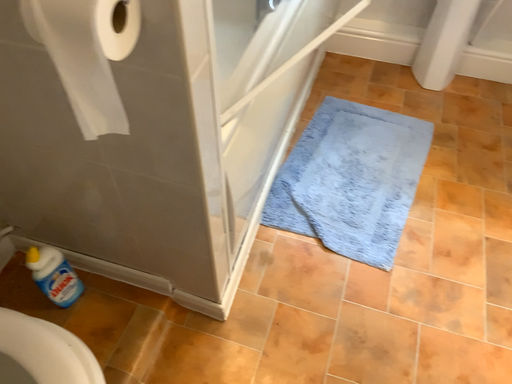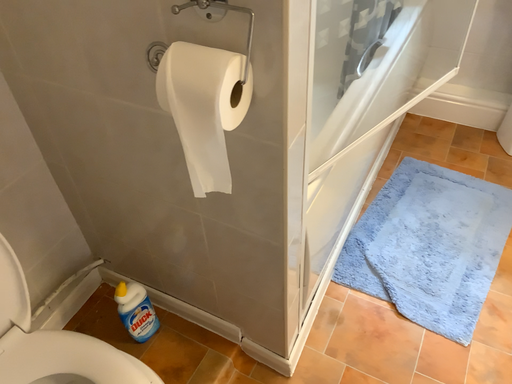
Question: How did the camera likely rotate when shooting the video?

Choices:
 (A) rotated downward
 (B) rotated upward

Answer: (B)